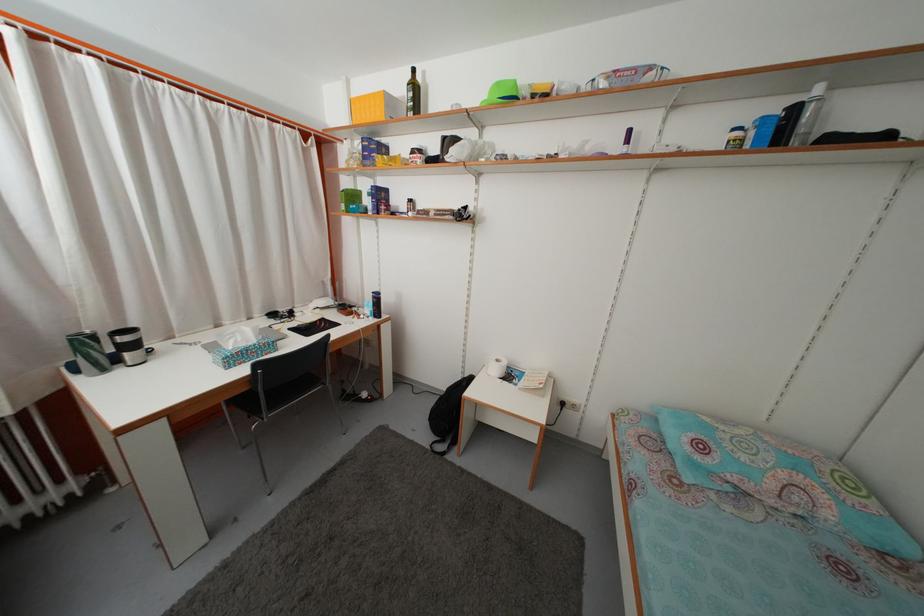
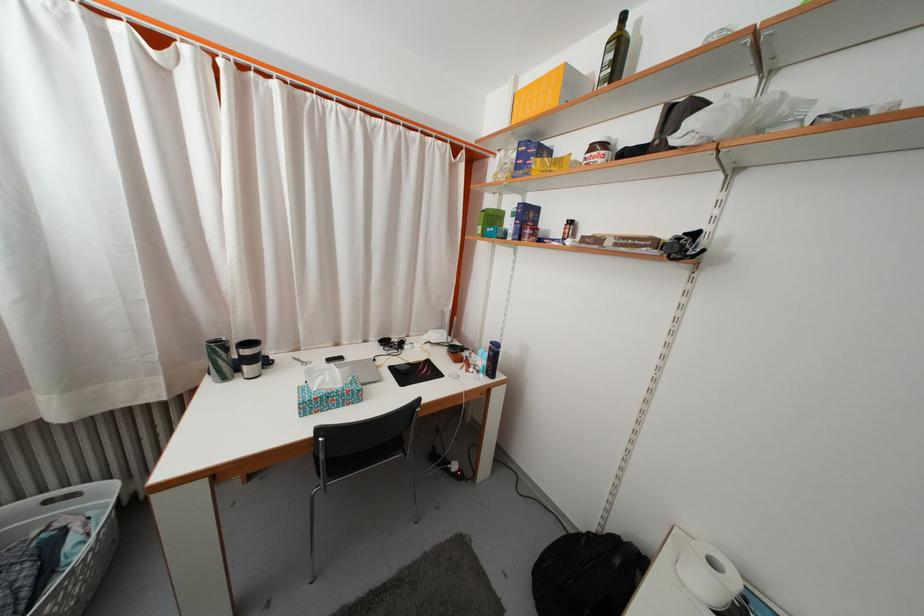
The point at (370, 164) is marked in the first image. Where is the corresponding point in the second image?

(523, 175)